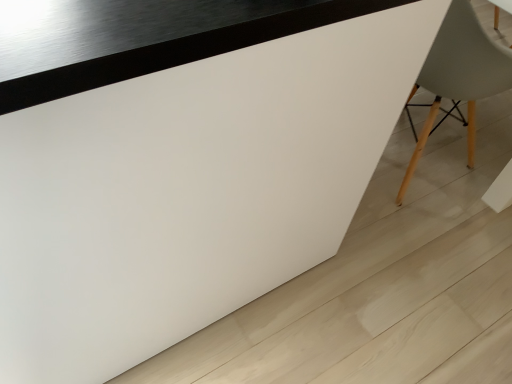
Question: Should I look upward or downward to see matte gray chair at right?

Choices:
 (A) down
 (B) up

Answer: (B)